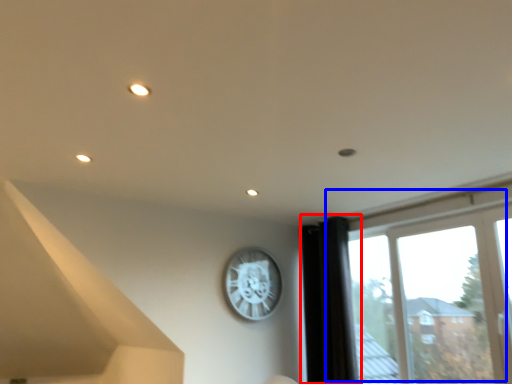
Question: Among these objects, which one is nearest to the camera, curtain (highlighted by a red box) or window (highlighted by a blue box)?

Choices:
 (A) curtain
 (B) window

Answer: (B)